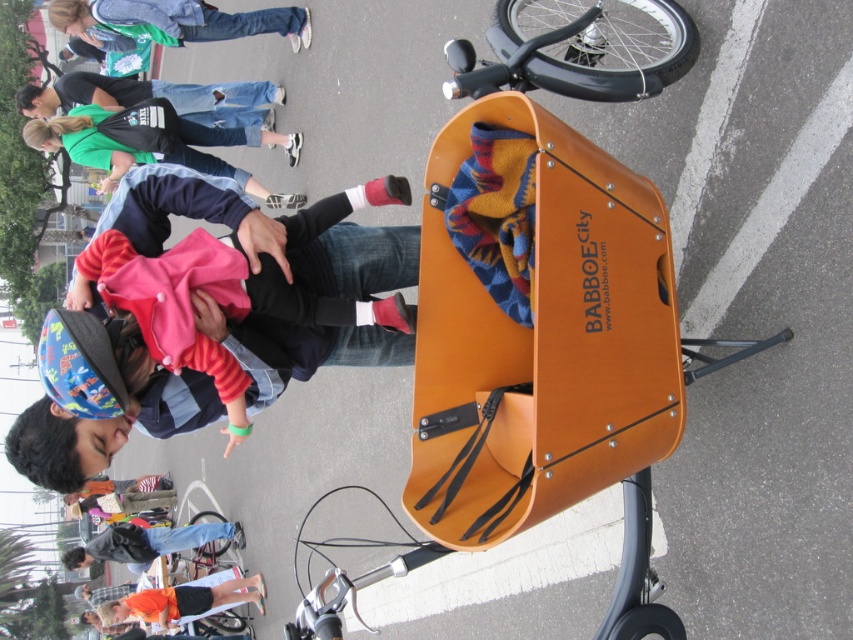
Question: Is matte green shirt at upper left bigger than denim jeans at upper left?

Choices:
 (A) yes
 (B) no

Answer: (A)

Question: Is denim jeans at upper left above orange fabric shirt at lower left?

Choices:
 (A) no
 (B) yes

Answer: (B)

Question: Which point is closer to the camera taking this photo?

Choices:
 (A) (183, 586)
 (B) (47, 104)
 (C) (306, 314)
 (D) (123, 122)

Answer: (C)

Question: Which of the following is the farthest from the observer?

Choices:
 (A) soft pink fabric at center
 (B) black leather jacket at lower left
 (C) denim jeans at upper left
 (D) matte green shirt at upper left

Answer: (B)

Question: Can you confirm if soft pink fabric at center is wider than denim jeans at upper left?

Choices:
 (A) no
 (B) yes

Answer: (A)

Question: Which object appears closest to the camera in this image?

Choices:
 (A) denim jeans at upper left
 (B) black leather jacket at lower left

Answer: (A)